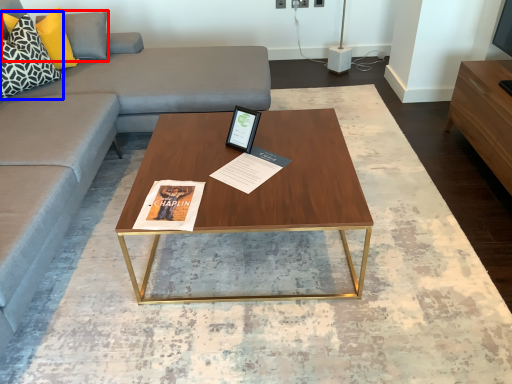
Question: Among these objects, which one is nearest to the camera, pillow (highlighted by a red box) or pillow (highlighted by a blue box)?

Choices:
 (A) pillow
 (B) pillow

Answer: (B)